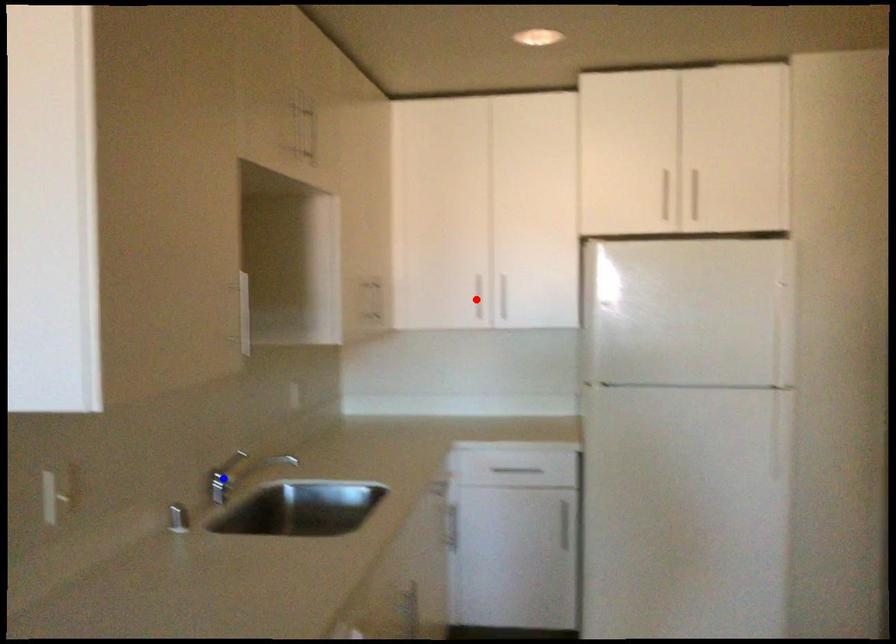
Question: In the image, two points are highlighted. Which point is nearer to the camera? Reply with the corresponding letter.

Choices:
 (A) blue point
 (B) red point

Answer: (A)